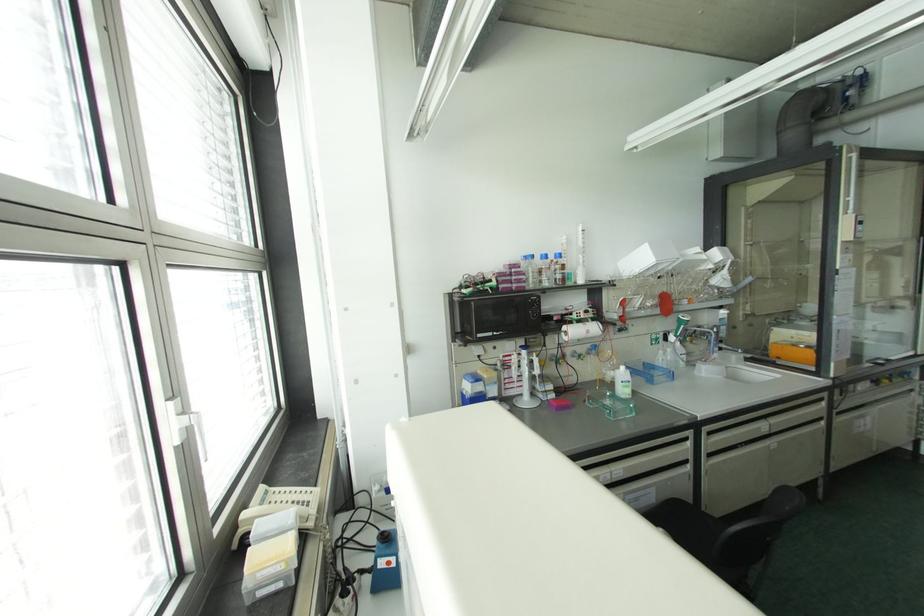
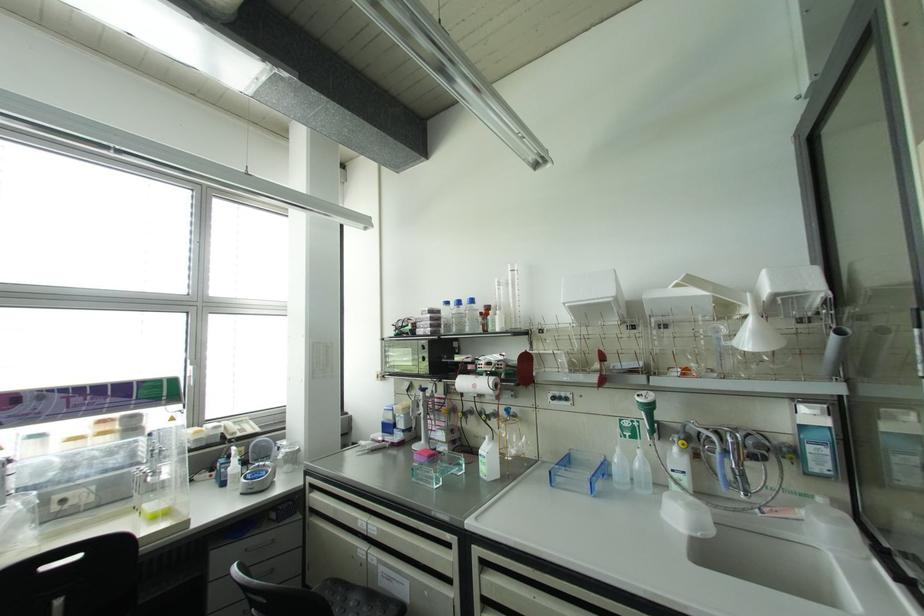
In the second image, find the point that corresponds to (x=588, y=331) in the first image.

(473, 386)